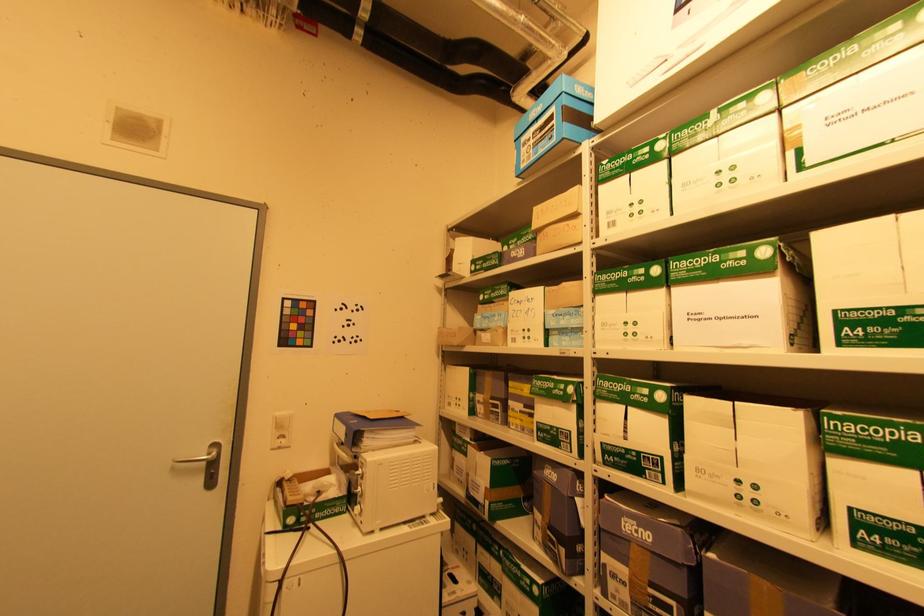
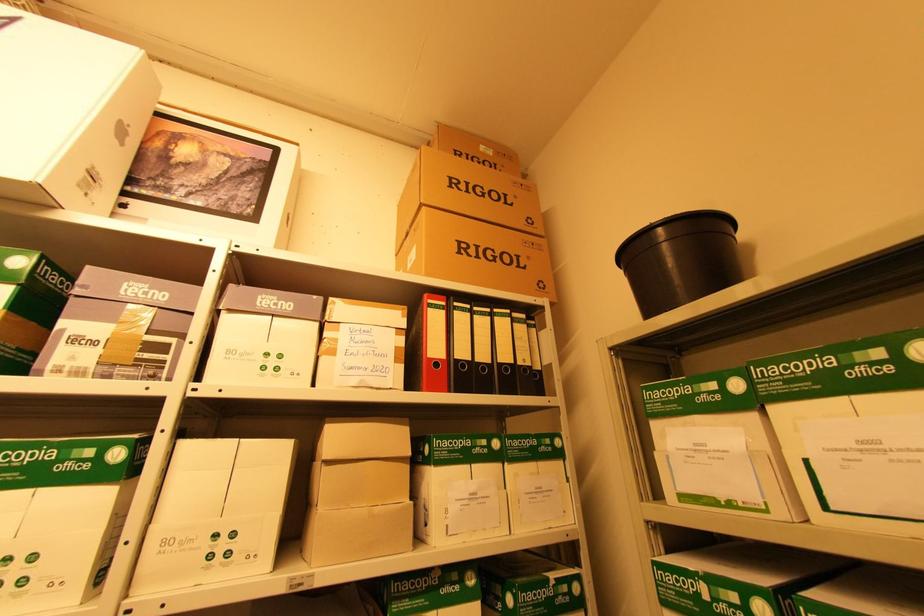
The images are taken continuously from a first-person perspective. In which direction is your viewpoint rotating?

The camera rotated toward right-up.